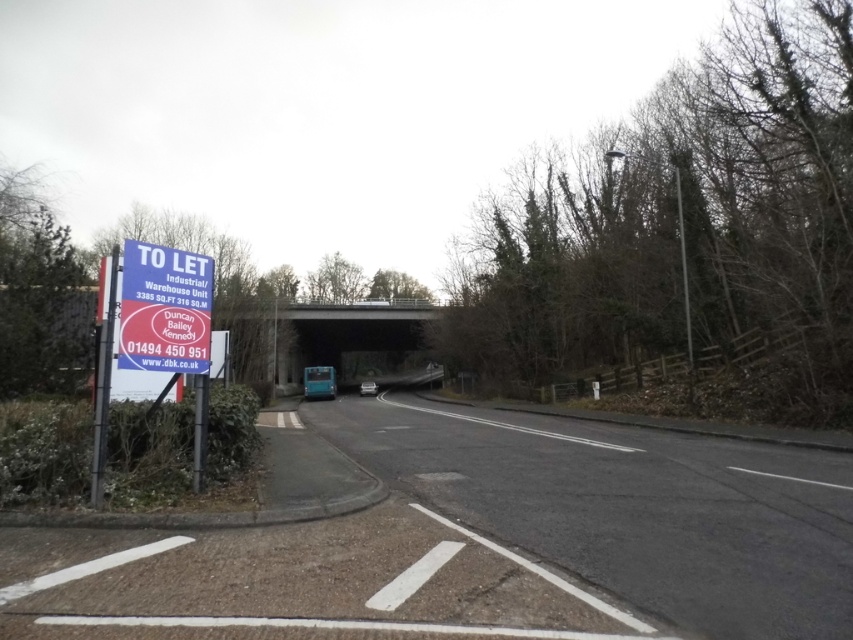
You are driving a car and see the black asphalt road at center and the blue plastic sign at left. Which object is closer to you?

The black asphalt road at center is closer to the viewer than the blue plastic sign at left.

You are driving a delivery van that is 2.5 meters wide. You need to navigate through the black asphalt road at center and the blue plastic sign at left. Which path is wider and can accommodate your van?

The black asphalt road at center is wider than the blue plastic sign at left, so the van can safely pass through the road.